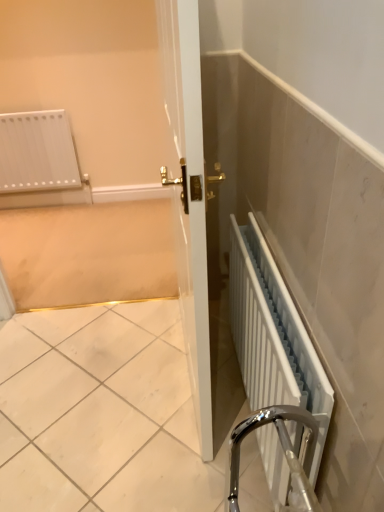
Question: From a real-world perspective, is white metallic radiator at lower right physically located above or below white glossy radiator at upper left?

Choices:
 (A) below
 (B) above

Answer: (A)

Question: Considering the positions of white metallic radiator at lower right and white glossy radiator at upper left in the image, is white metallic radiator at lower right wider or thinner than white glossy radiator at upper left?

Choices:
 (A) thin
 (B) wide

Answer: (A)

Question: Considering the positions of point (281, 374) and point (44, 97), is point (281, 374) closer or farther from the camera than point (44, 97)?

Choices:
 (A) closer
 (B) farther

Answer: (A)

Question: Choose the correct answer: Is white glossy radiator at upper left inside white metallic radiator at lower right or outside it?

Choices:
 (A) outside
 (B) inside

Answer: (A)

Question: Based on their sizes in the image, would you say white glossy radiator at upper left is bigger or smaller than white metallic radiator at lower right?

Choices:
 (A) big
 (B) small

Answer: (A)

Question: From the image's perspective, relative to white metallic radiator at lower right, is white glossy radiator at upper left above or below?

Choices:
 (A) above
 (B) below

Answer: (A)

Question: In terms of width, does white glossy radiator at upper left look wider or thinner when compared to white metallic radiator at lower right?

Choices:
 (A) thin
 (B) wide

Answer: (B)